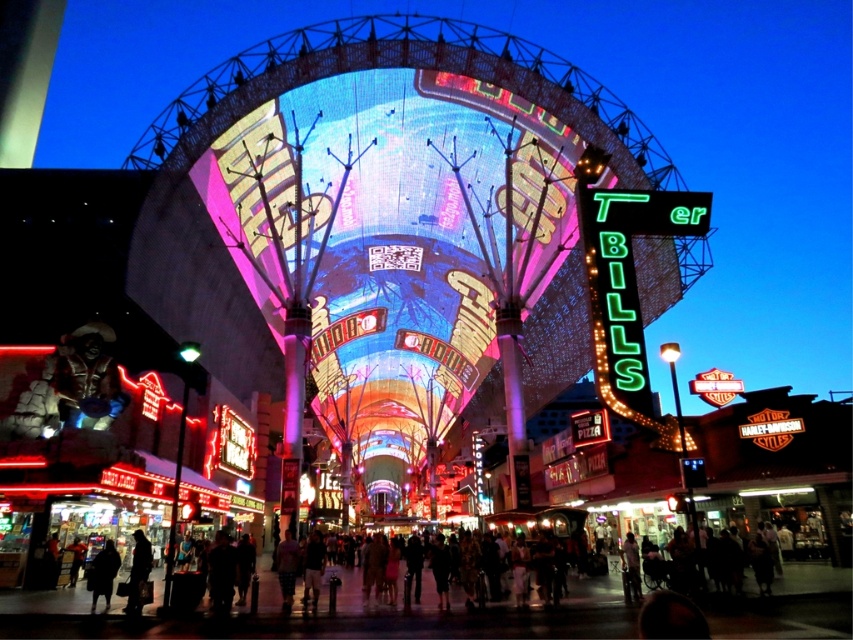
Between dark clothing at lower left and dark wool coat at lower left, which one is positioned lower?

dark clothing at lower left is below.

Describe the element at coordinates (138, 572) in the screenshot. I see `dark clothing at lower left` at that location.

I want to click on dark clothing at lower left, so click(x=138, y=572).